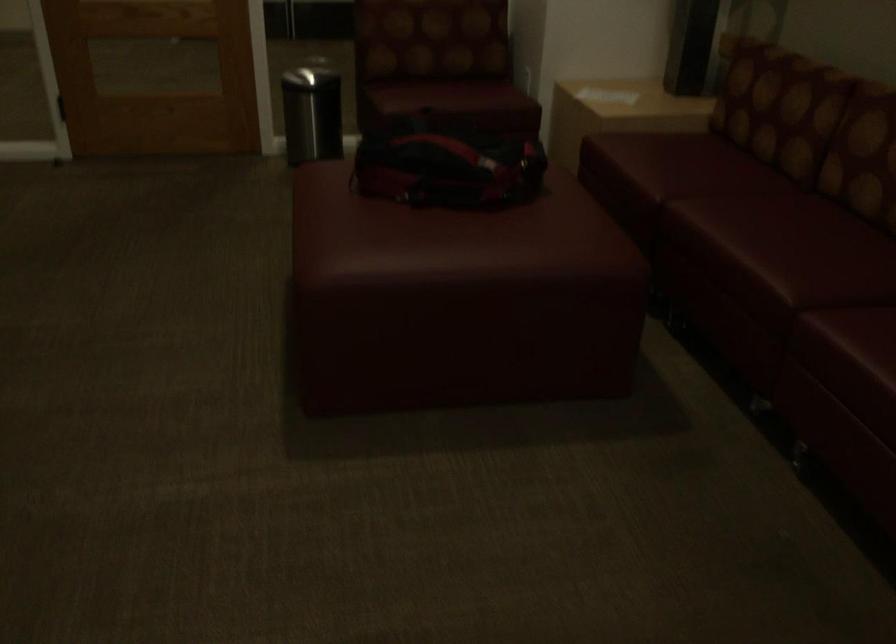
The width and height of the screenshot is (896, 644). What do you see at coordinates (451, 237) in the screenshot? I see `a red ottoman surface` at bounding box center [451, 237].